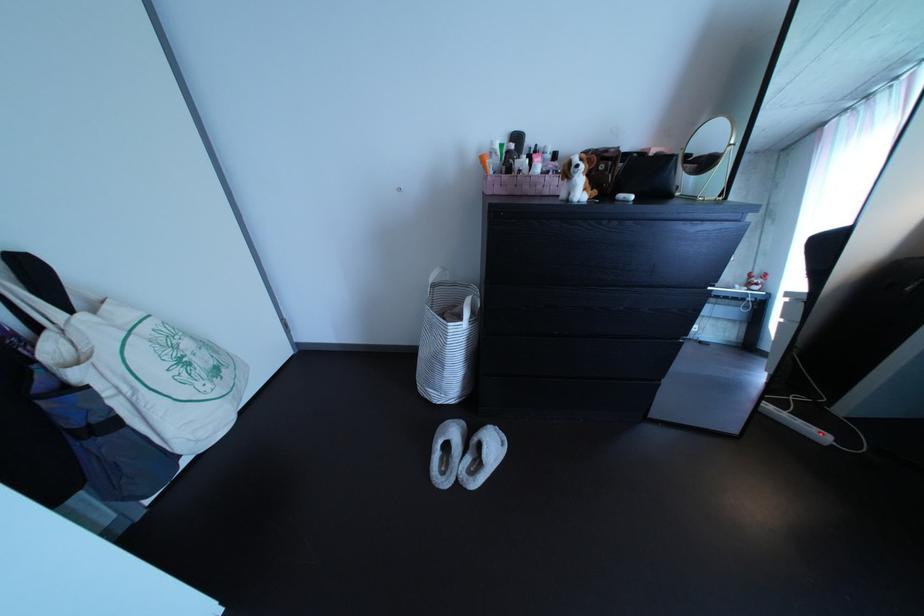
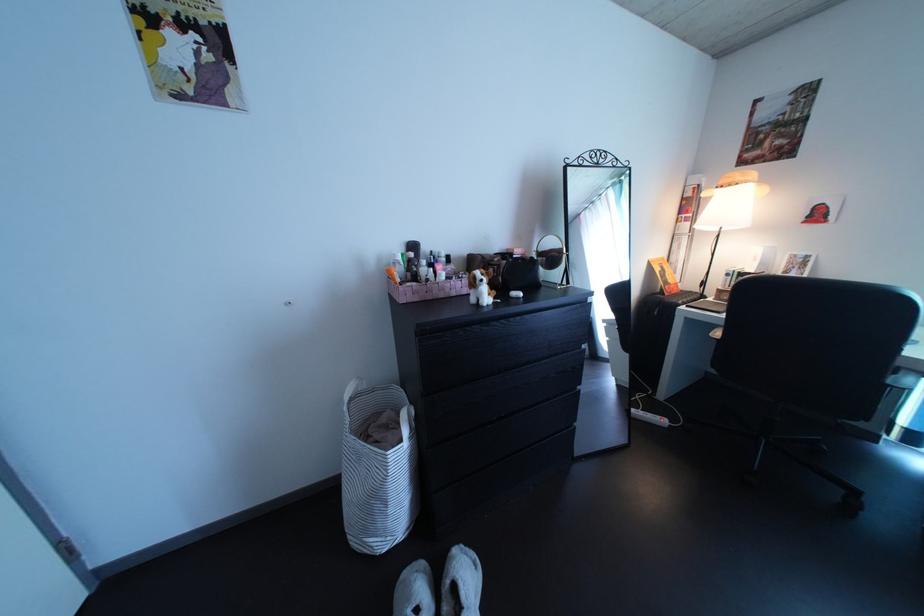
Where in the second image is the point corresponding to pixel 523 161 from the first image?

(424, 269)